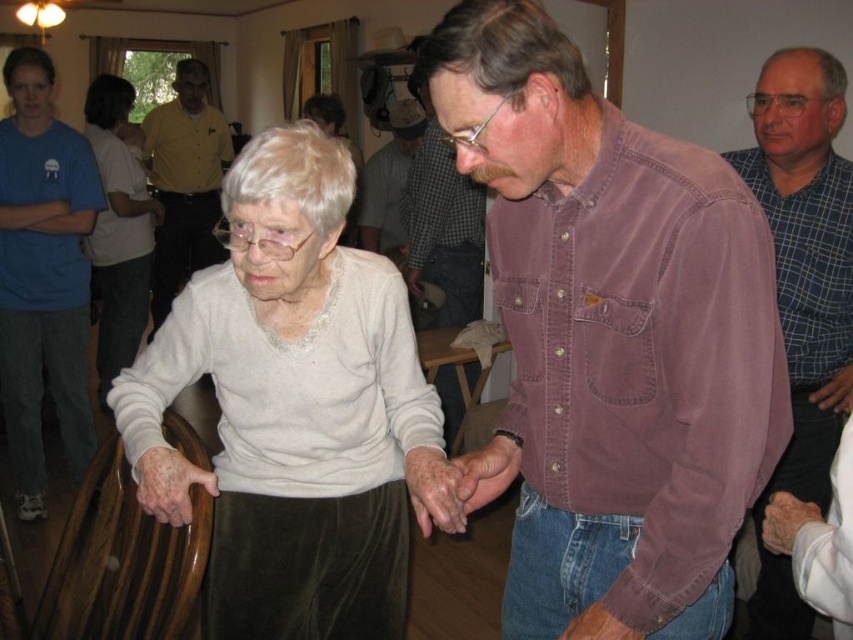
Looking at this image, does white matte sweater at upper left appear on the left side of brown corduroy shirt at center?

Correct, you'll find white matte sweater at upper left to the left of brown corduroy shirt at center.

I want to click on white matte sweater at upper left, so click(119, 228).

Is point (142, 305) positioned behind point (410, 173)?

That is True.

The image size is (853, 640). In order to click on white matte sweater at upper left in this screenshot , I will do `click(119, 228)`.

Can you confirm if brown corduroy shirt at center is bigger than plaid shirt at center?

Yes, brown corduroy shirt at center is bigger than plaid shirt at center.

The width and height of the screenshot is (853, 640). Find the location of `brown corduroy shirt at center`. brown corduroy shirt at center is located at coordinates (442, 221).

Identify the location of brown corduroy shirt at center. This screenshot has height=640, width=853. tap(442, 221).

Between checkered fabric shirt at upper right and brown corduroy shirt at center, which one has more height?

checkered fabric shirt at upper right is taller.

Does point (773, 211) come closer to viewer compared to point (439, 390)?

Yes, it is in front of point (439, 390).

Where is `checkered fabric shirt at upper right`? checkered fabric shirt at upper right is located at coordinates (802, 291).